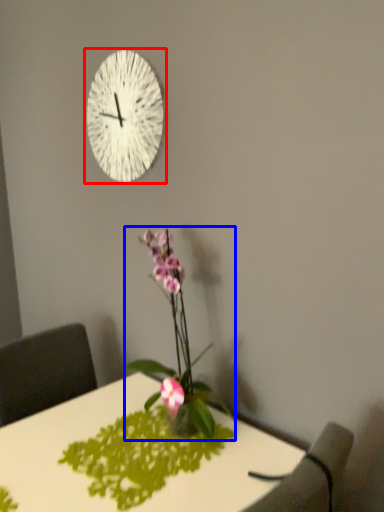
Question: Which object is further to the camera taking this photo, wall clock (highlighted by a red box) or houseplant (highlighted by a blue box)?

Choices:
 (A) wall clock
 (B) houseplant

Answer: (A)